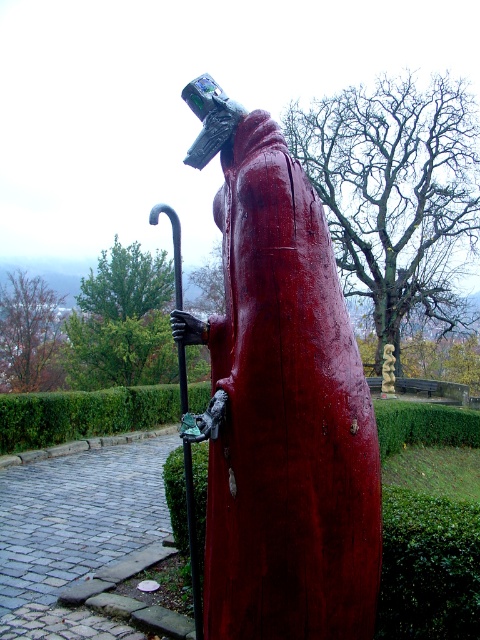
Does glossy wood statue at center have a lesser width compared to black metal pole at center?

Indeed, glossy wood statue at center has a lesser width compared to black metal pole at center.

Image resolution: width=480 pixels, height=640 pixels. What do you see at coordinates (280, 401) in the screenshot?
I see `glossy wood statue at center` at bounding box center [280, 401].

Who is more forward, (299, 336) or (188, 449)?

Point (299, 336)

Find the location of a particular element. Image resolution: width=480 pixels, height=640 pixels. glossy wood statue at center is located at coordinates (280, 401).

Is glossy wood statue at center in front of wooden spiral at center?

That is True.

Who is positioned more to the left, glossy wood statue at center or wooden spiral at center?

glossy wood statue at center

This screenshot has height=640, width=480. Find the location of `glossy wood statue at center`. glossy wood statue at center is located at coordinates (280, 401).

Locate an element on the screen. The image size is (480, 640). glossy wood statue at center is located at coordinates (280, 401).

Does black metal pole at center have a lesser width compared to wooden spiral at center?

Incorrect, black metal pole at center's width is not less than wooden spiral at center's.

Is black metal pole at center to the right of wooden spiral at center from the viewer's perspective?

Incorrect, black metal pole at center is not on the right side of wooden spiral at center.

Who is more distant from viewer, (193, 593) or (391, 364)?

The point (391, 364) is more distant.

The width and height of the screenshot is (480, 640). I want to click on black metal pole at center, so click(192, 540).